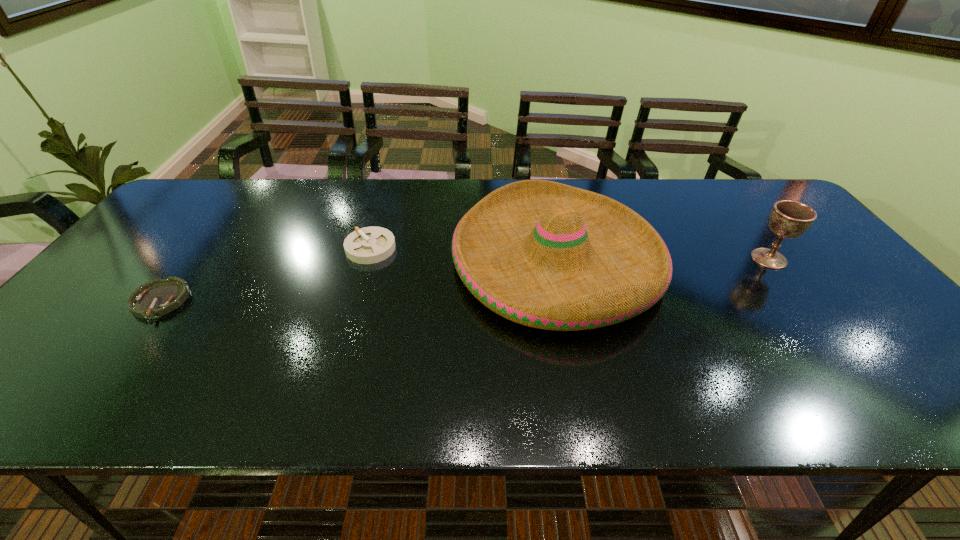
I want to click on object that is at the far edge, so click(543, 254).

Find the location of `object positioned at the left edge`. object positioned at the left edge is located at coordinates (158, 297).

Identify the location of object that is at the right edge. (789, 219).

You are a GUI agent. You are given a task and a screenshot of the screen. Output one action in this format:
    pyautogui.click(x=<x>, y=<y>)
    Task: Click on the free spot at the far edge of the desktop
    Image resolution: width=960 pixels, height=540 pixels.
    Given the screenshot: What is the action you would take?
    pyautogui.click(x=448, y=191)

In the image, there is a desktop. At what (x,y) coordinates should I click in order to perform the action: click on vacant space at the near edge. Please return your answer as a coordinate pair (x, y). This screenshot has width=960, height=540. Looking at the image, I should click on (568, 393).

Locate an element on the screen. Image resolution: width=960 pixels, height=540 pixels. vacant space at the left edge of the desktop is located at coordinates (151, 247).

At what (x,y) coordinates should I click in order to perform the action: click on free space at the right edge. Please return your answer as a coordinate pair (x, y). Looking at the image, I should click on (890, 372).

At what (x,y) coordinates should I click in order to perform the action: click on free space between the left ashtray and the sombrero. Please return your answer as a coordinate pair (x, y). Looking at the image, I should click on (358, 281).

Find the location of a particular element. Image resolution: width=960 pixels, height=540 pixels. empty space between the third tallest object and the nearer ashtray is located at coordinates (265, 274).

Locate an element on the screen. The height and width of the screenshot is (540, 960). vacant area that lies between the second object from right to left and the shortest object is located at coordinates (358, 281).